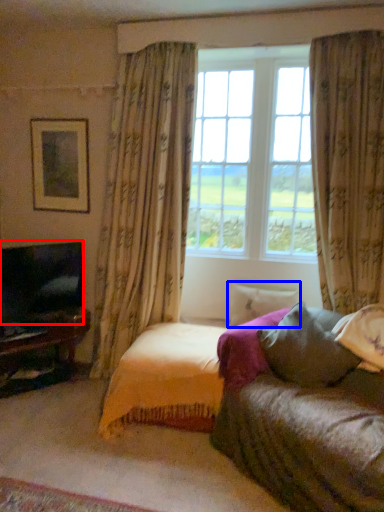
Question: Which of the following is the farthest to the observer, television (highlighted by a red box) or pillow (highlighted by a blue box)?

Choices:
 (A) television
 (B) pillow

Answer: (B)